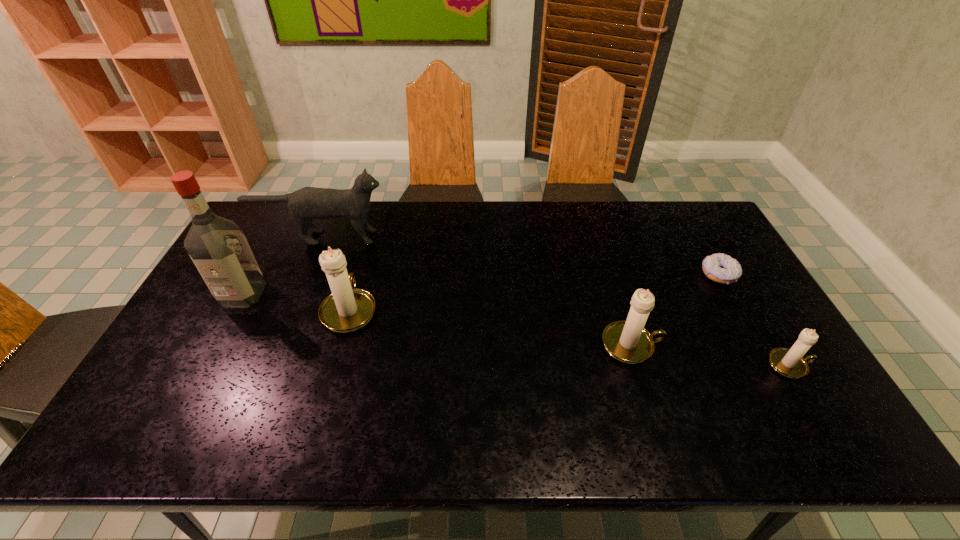
Please determine a free point for an extra candle_holder to ensure balance. Please provide its 2D coordinates. Your answer should be formatted as a tuple, i.e. [(x, y)], where the tuple contains the x and y coordinates of a point satisfying the conditions above.

[(486, 326)]